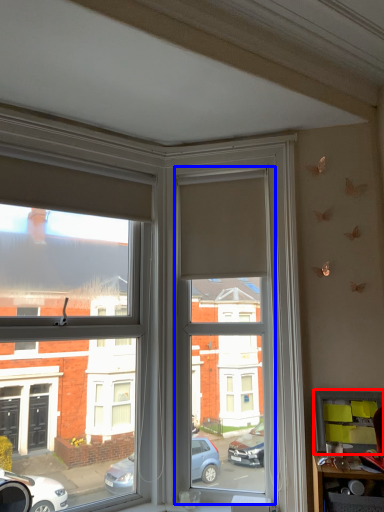
Question: Which point is further to the camera, shelf (highlighted by a red box) or window screen (highlighted by a blue box)?

Choices:
 (A) shelf
 (B) window screen

Answer: (B)